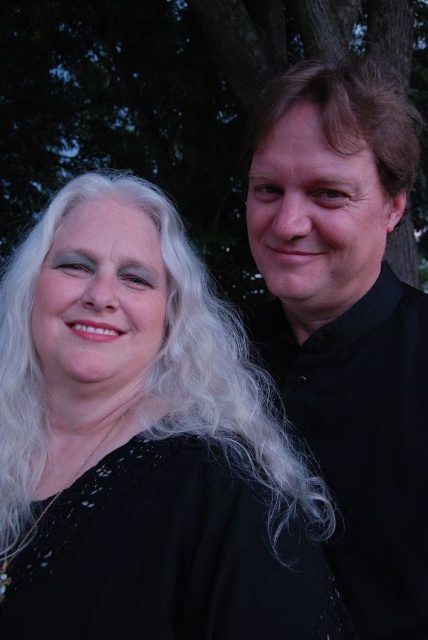
Is the position of black smooth shirt at right more distant than that of dark brown wood tree at upper center?

That is False.

Does black smooth shirt at right have a greater height compared to dark brown wood tree at upper center?

In fact, black smooth shirt at right may be shorter than dark brown wood tree at upper center.

Is point (416, 416) positioned before point (9, 173)?

That is True.

This screenshot has width=428, height=640. What are the coordinates of `black smooth shirt at right` in the screenshot? It's located at (347, 323).

Who is positioned more to the left, dark brown wood tree at upper center or black lace dress at center?

dark brown wood tree at upper center is more to the left.

Is dark brown wood tree at upper center thinner than black lace dress at center?

In fact, dark brown wood tree at upper center might be wider than black lace dress at center.

Is point (48, 8) behind point (177, 589)?

Yes.

Locate an element on the screen. The height and width of the screenshot is (640, 428). dark brown wood tree at upper center is located at coordinates (181, 102).

Can you confirm if black matte dress at center is thinner than dark brown wood tree at upper center?

Indeed, black matte dress at center has a lesser width compared to dark brown wood tree at upper center.

Can you confirm if black matte dress at center is positioned below dark brown wood tree at upper center?

Yes.

Which is in front, point (160, 228) or point (41, 48)?

Point (160, 228) is more forward.

What are the coordinates of `black matte dress at center` in the screenshot? It's located at (142, 444).